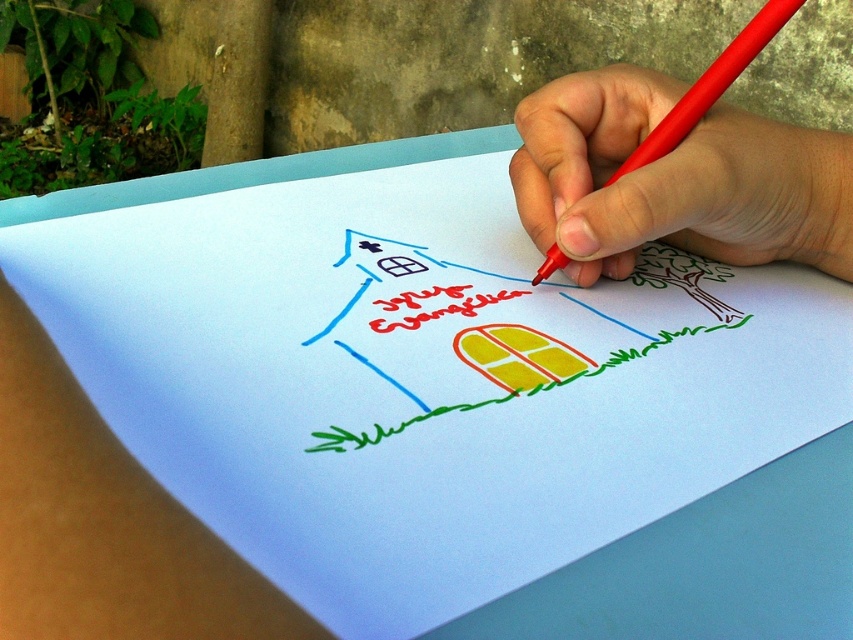
Measure the distance between smooth red pen at upper right and white paper at center.

2.91 inches

Who is positioned more to the right, smooth red pen at upper right or white paper at center?

smooth red pen at upper right

Does point (604, 106) come in front of point (445, 308)?

No.

At what (x,y) coordinates should I click in order to perform the action: click on smooth red pen at upper right. Please return your answer as a coordinate pair (x, y). The image size is (853, 640). Looking at the image, I should click on (675, 179).